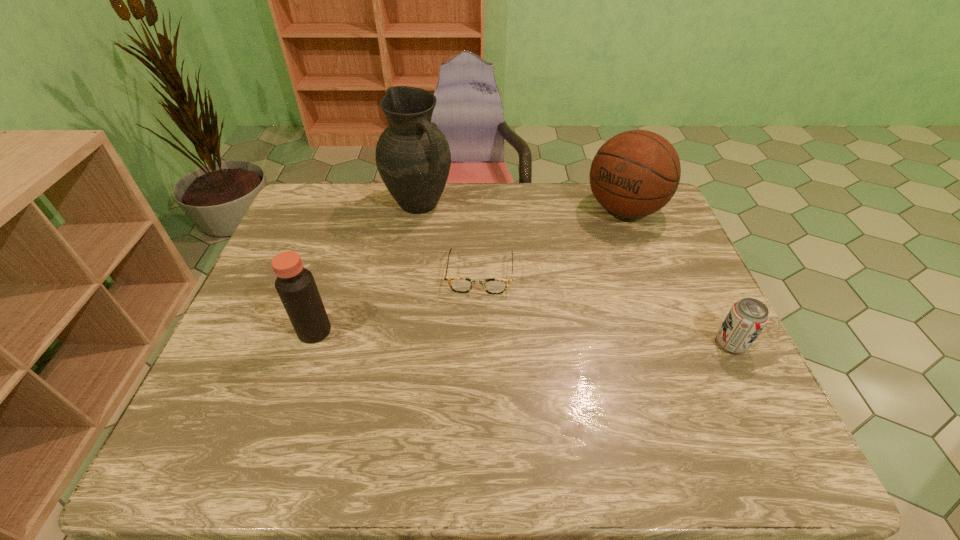
Where is `beer can positioned at the right edge`? The image size is (960, 540). beer can positioned at the right edge is located at coordinates (746, 319).

Find the location of a particular element. The height and width of the screenshot is (540, 960). basketball at the right edge is located at coordinates (635, 173).

Where is `object situated at the far right corner`? This screenshot has height=540, width=960. object situated at the far right corner is located at coordinates (635, 173).

In the image, there is a desktop. Where is `vacant space at the far edge`? The height and width of the screenshot is (540, 960). vacant space at the far edge is located at coordinates (484, 186).

Find the location of a particular element. Image resolution: width=960 pixels, height=540 pixels. vacant space at the near edge of the desktop is located at coordinates (456, 380).

At what (x,y) coordinates should I click in order to perform the action: click on blank space at the left edge of the desktop. Please return your answer as a coordinate pair (x, y). Looking at the image, I should click on (312, 269).

Find the location of a particular element. Image resolution: width=960 pixels, height=540 pixels. vacant space at the right edge of the desktop is located at coordinates (680, 271).

You are a GUI agent. You are given a task and a screenshot of the screen. Output one action in this format:
    pyautogui.click(x=<x>, y=<y>)
    Task: Click on the free space at the near left corner
    
    Given the screenshot: What is the action you would take?
    pyautogui.click(x=241, y=399)

Locate an element on the screen. The height and width of the screenshot is (540, 960). blank space at the near right corner is located at coordinates (704, 386).

You are a GUI agent. You are given a task and a screenshot of the screen. Output one action in this format:
    pyautogui.click(x=<x>, y=<y>)
    Task: Click on the vacant space that is in between the basketball and the vinegar
    The height and width of the screenshot is (540, 960).
    Given the screenshot: What is the action you would take?
    pyautogui.click(x=469, y=271)